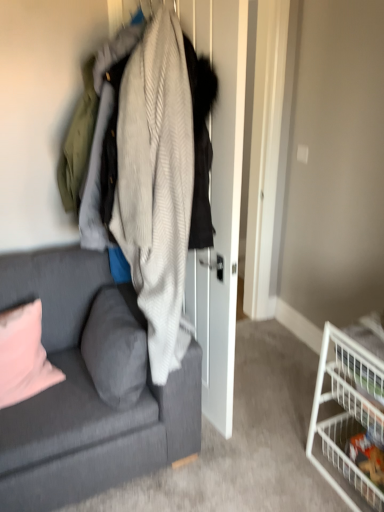
Identify the location of free space to the left of white wire basket at lower right, the second shelf from the bottom. The width and height of the screenshot is (384, 512). (283, 458).